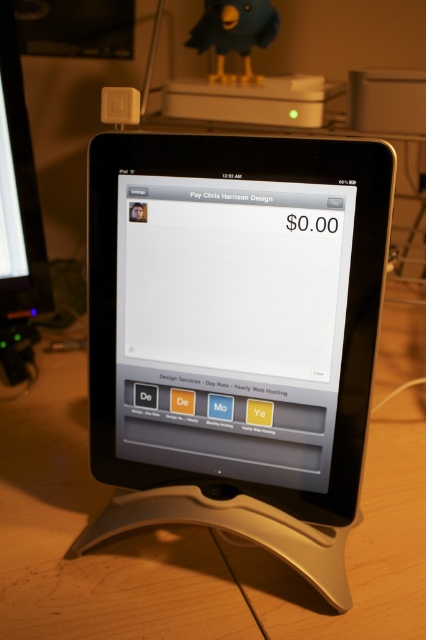
You are holding a pen that is 6 inches long. You want to touch the point at coordinates point (247, 141) on the tablet screen without moving your hand. Can you reach it with your pen?

The point (247, 141) is 16.97 inches away from the camera. Since your pen is only 6 inches long, you cannot reach it without moving your hand.

You are trying to determine the best path to place a small sticker on the tablet screen without blocking important buttons. You have two options to place it at either point coordinates given. Which point is closer to you, point (299, 230) or point (267, 432)?

Point (299, 230) is closer to the viewer than point (267, 432), so placing the sticker there would be better if you want it closer.

Based on the photo, you are organizing a tech fair booth and need to place two identical black tablets on a desk. The tablets are labeled as black matte tablet at center and matte black tablet at center. According to the scene, which tablet is positioned to the left?

The black matte tablet at center is positioned to the left of the matte black tablet at center.